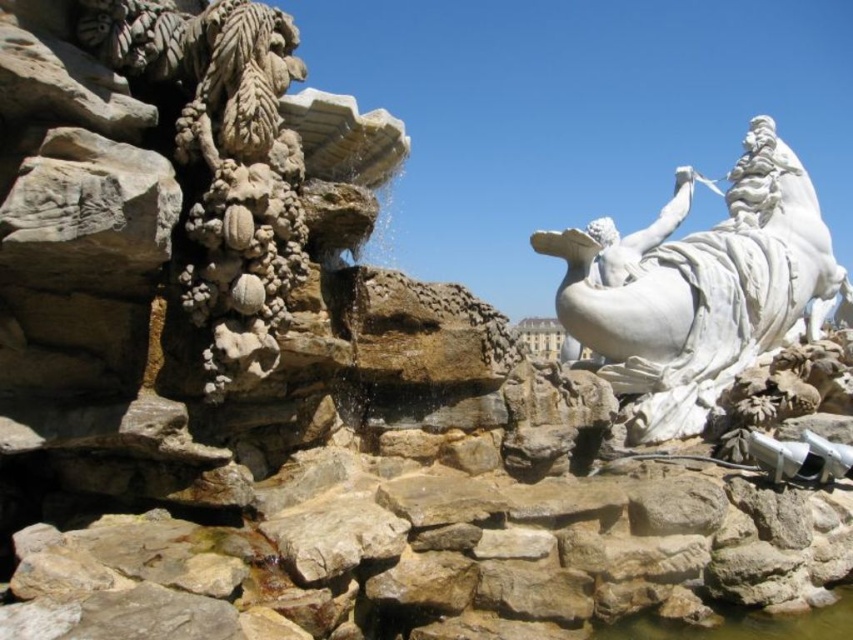
You are standing in front of the fountain and want to place a decorative stone on the right side of the clear water at rock bottom. Is there enough space to place it without overlapping the white marble statue at right?

The white marble statue at right is positioned on the right side of clear water at rock bottom, so placing a decorative stone on the right side of the clear water at rock bottom would overlap with the white marble statue at right. Choose another location.

You are a photographer planning to capture the white marble statue at right and the clear water at rock bottom in a single frame. Given that the statue is taller than the water, how should you position your camera to ensure both elements are fully visible?

To ensure both the white marble statue at right and the clear water at rock bottom are fully visible in the frame, position your camera at a lower angle so that you can capture the full height of the statue while still including the clear water at rock bottom in the lower part of the image.